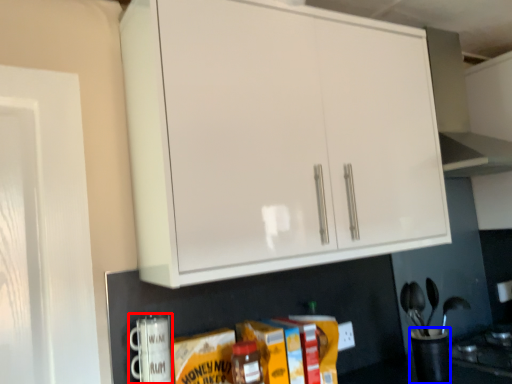
Question: Which point is further to the camera, appliance (highlighted by a red box) or appliance (highlighted by a blue box)?

Choices:
 (A) appliance
 (B) appliance

Answer: (B)